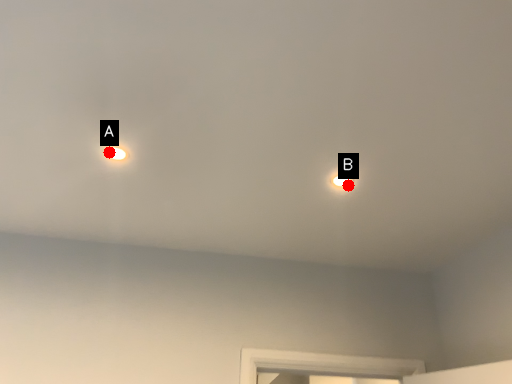
Question: Two points are circled on the image, labeled by A and B beside each circle. Among these points, which one is nearest to the camera?

Choices:
 (A) A is closer
 (B) B is closer

Answer: (A)